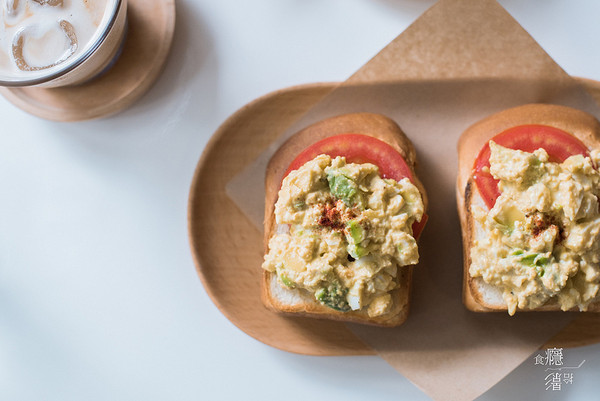
The width and height of the screenshot is (600, 401). What are the coordinates of `plate` in the screenshot? It's located at (236, 270).